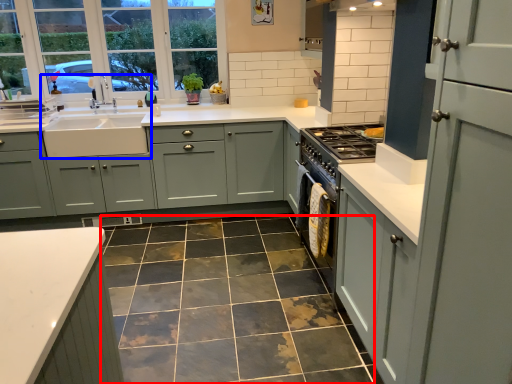
Question: Which of the following is the farthest to the observer, ceramic tile (highlighted by a red box) or sink (highlighted by a blue box)?

Choices:
 (A) ceramic tile
 (B) sink

Answer: (B)